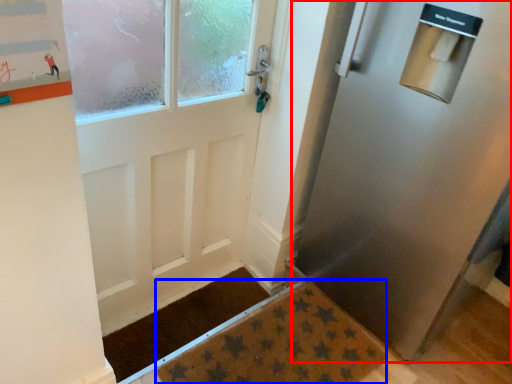
Question: Which point is closer to the camera, door (highlighted by a red box) or doormat (highlighted by a blue box)?

Choices:
 (A) door
 (B) doormat

Answer: (A)